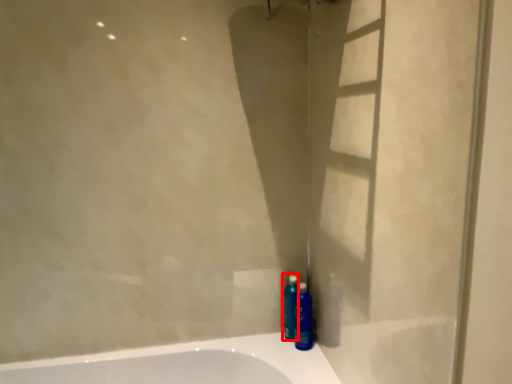
Question: Observing the image, what is the correct spatial positioning of cleaning product (annotated by the red box) in reference to mouthwash?

Choices:
 (A) left
 (B) right

Answer: (A)